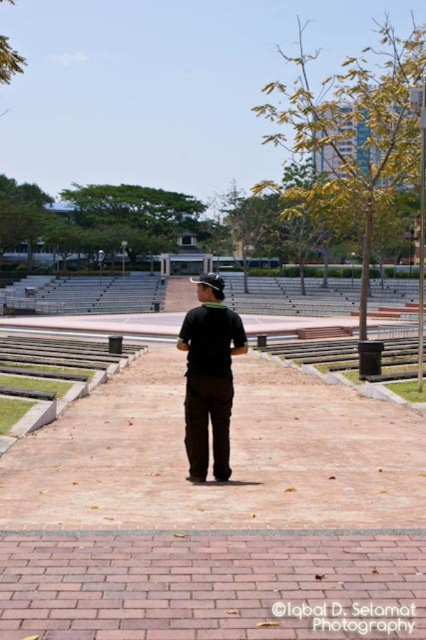
Does brown brick path at center have a smaller size compared to black matte shirt at center?

No, brown brick path at center is not smaller than black matte shirt at center.

Is brown brick path at center positioned at the back of black matte shirt at center?

No, brown brick path at center is closer to the viewer.

Identify the location of brown brick path at center. 230,456.